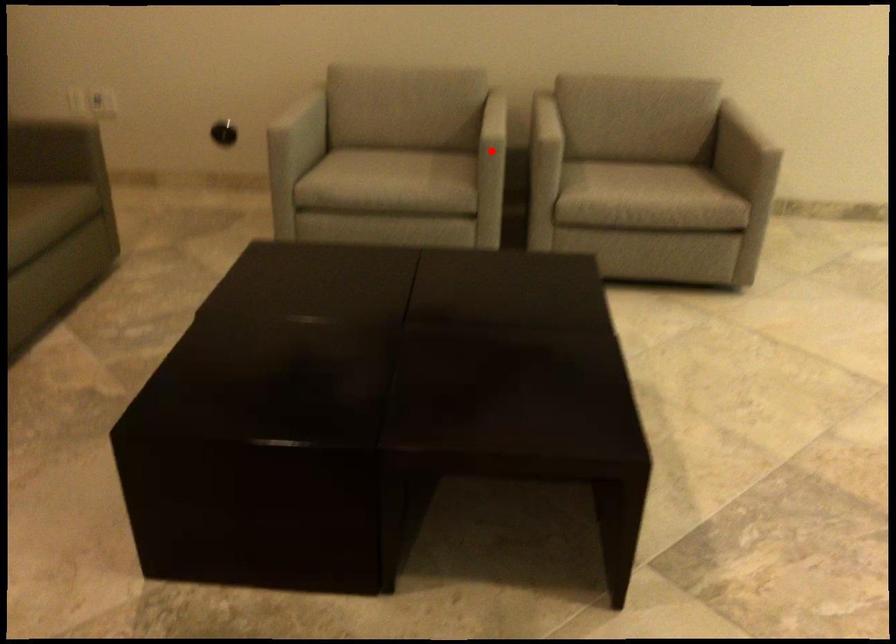
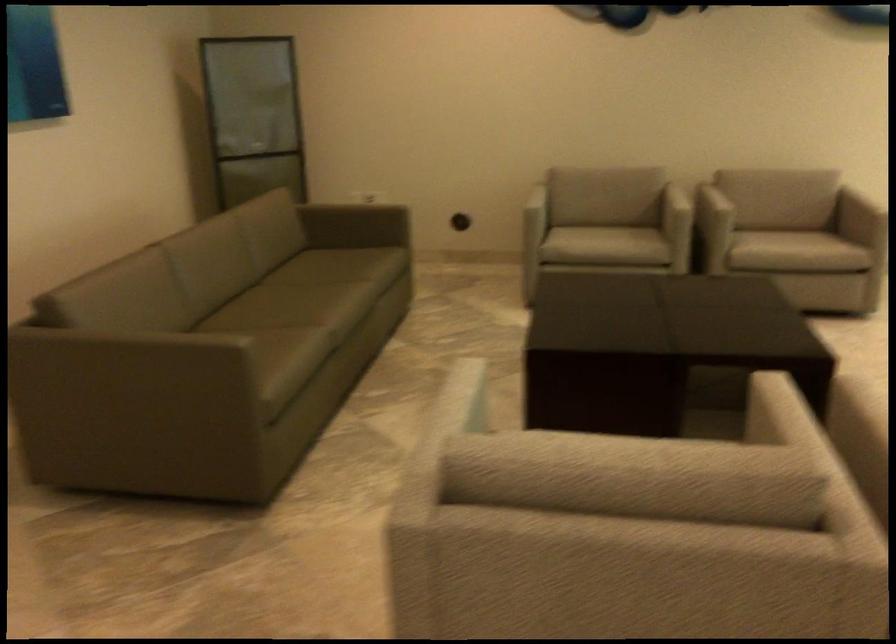
Question: I am providing you with two images of the same scene from different viewpoints. Image1 has a red point marked. In image2, the corresponding 3D location appears at what relative position? Reply with the corresponding letter.

Choices:
 (A) Closer
 (B) Farther

Answer: (B)